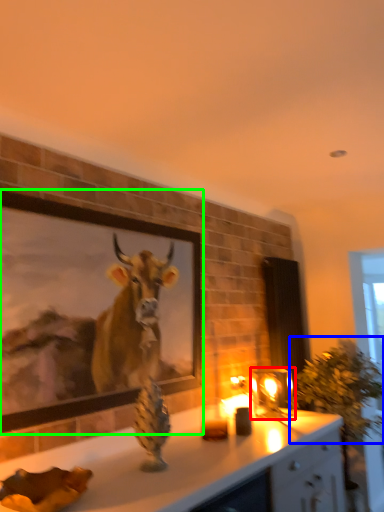
Question: Estimate the real-world distances between objects in this image. Which object is farther from candle holder (highlighted by a red box), plant (highlighted by a blue box) or picture frame (highlighted by a green box)?

Choices:
 (A) plant
 (B) picture frame

Answer: (B)